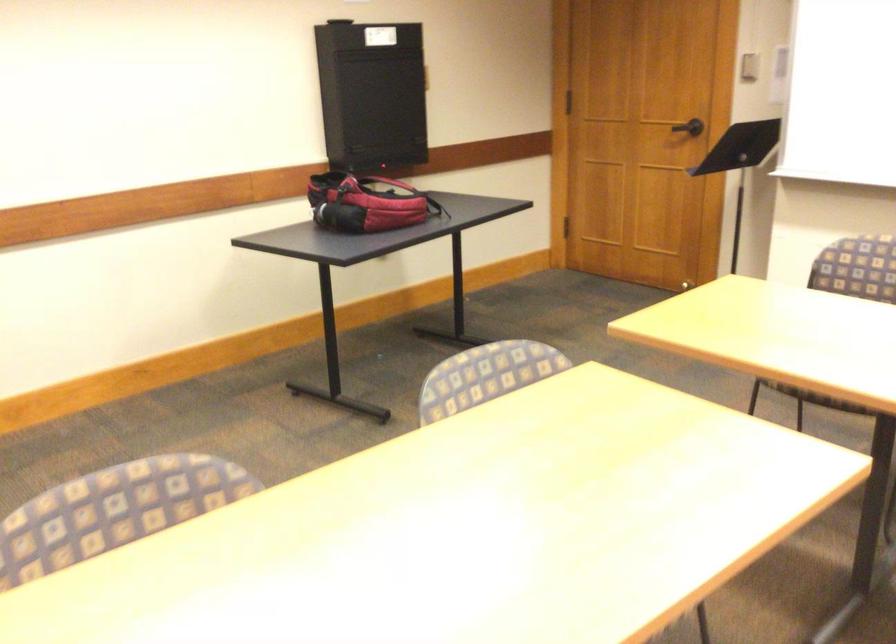
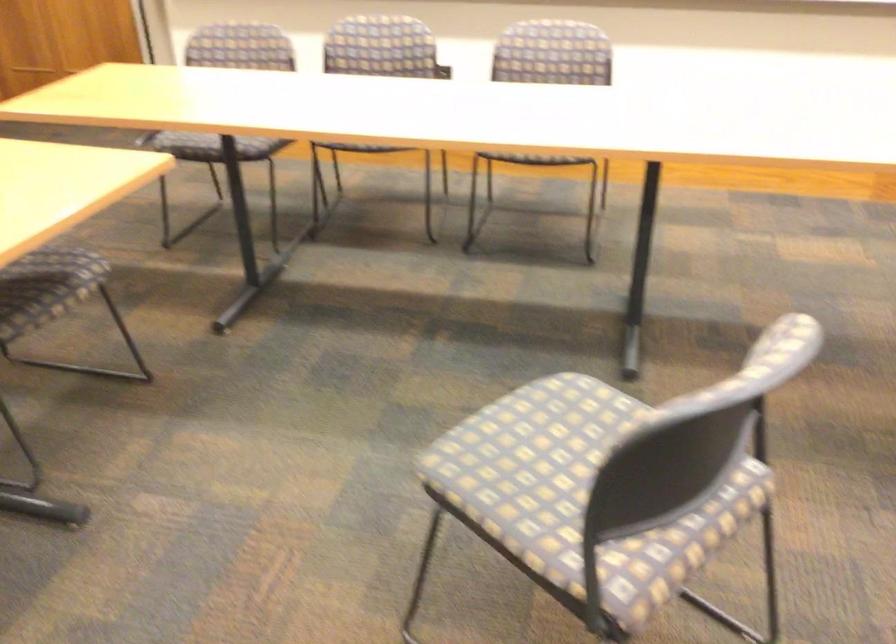
Question: The camera is either moving clockwise (left) or counter-clockwise (right) around the object. The first image is from the beginning of the video and the second image is from the end. Is the camera moving left or right when shooting the video?

Choices:
 (A) Left
 (B) Right

Answer: (A)